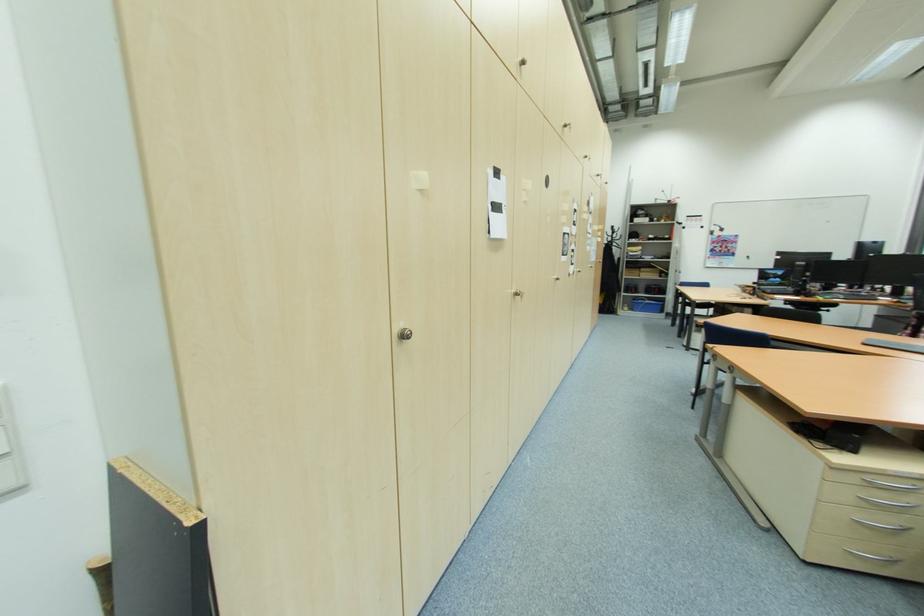
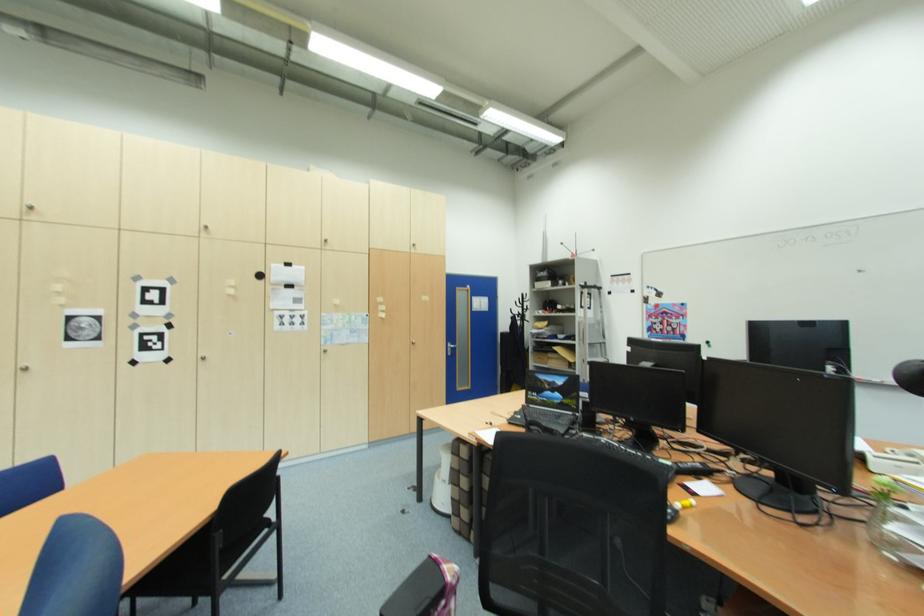
Where in the second image is the point corresponding to [786,283] from the first image?

(569, 402)